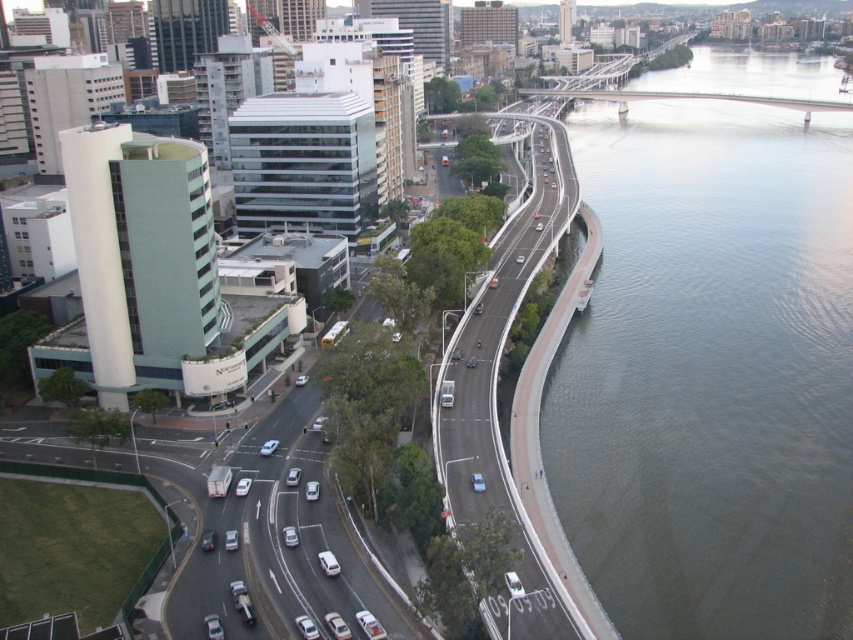
You are a drone operator flying a drone that is 2 meters tall. You want to fly your drone from the smooth asphalt highway at center right to the dark gray water at right. Is there enough vertical space for your drone to pass between them?

The dark gray water at right is taller than the smooth asphalt highway at center right. Since the drone is 2 meters tall, it can safely pass under the dark gray water at right as there is sufficient vertical clearance between the two objects.

You are a drone operator flying over an urban area. You need to determine the order of two points from closest to farthest from your current position. The points are point (x=682, y=548) and point (x=541, y=116). Based on the scene, which point is closer to you?

Point (x=682, y=548) is closer to the camera than point (x=541, y=116), so the order from closest to farthest is point (x=682, y=548) first and then point (x=541, y=116).